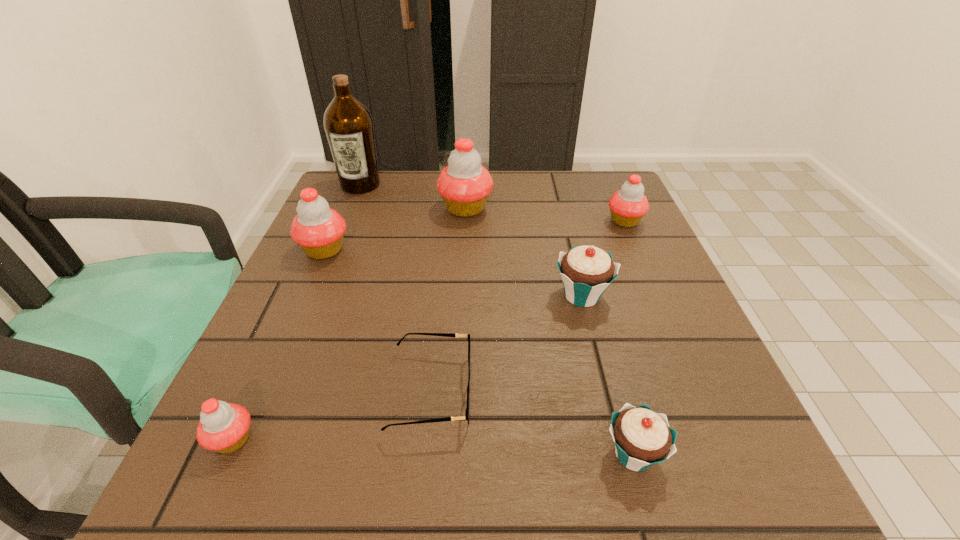
This screenshot has width=960, height=540. I want to click on vacant area at the right edge of the desktop, so click(x=632, y=275).

The image size is (960, 540). Find the location of `vacant space at the far left corner`. vacant space at the far left corner is located at coordinates (x=362, y=198).

The image size is (960, 540). In order to click on vacant area at the near left corner of the desktop in this screenshot , I will do pos(311,452).

In the image, there is a desktop. Where is `vacant area at the near right corner`? The width and height of the screenshot is (960, 540). vacant area at the near right corner is located at coordinates (691, 504).

The height and width of the screenshot is (540, 960). What are the coordinates of `blank region between the fifth farthest object and the third tallest object` in the screenshot? It's located at (453, 273).

This screenshot has width=960, height=540. What are the coordinates of `free space that is in between the rightmost cupcake and the shortest object` in the screenshot? It's located at pyautogui.click(x=528, y=306).

At what (x,y) coordinates should I click in order to perform the action: click on vacant area between the rightmost red cupcake and the shortest object. Please return your answer as a coordinate pair (x, y). This screenshot has width=960, height=540. Looking at the image, I should click on (528, 306).

This screenshot has height=540, width=960. I want to click on free space between the seventh shortest object and the rightmost red cupcake, so click(545, 215).

This screenshot has width=960, height=540. In order to click on free space between the olive oil and the biggest red cupcake in this screenshot , I will do pos(413,197).

At what (x,y) coordinates should I click in order to perform the action: click on vacant space in between the fourth farthest cupcake and the brown olive oil. Please return your answer as a coordinate pair (x, y). Looking at the image, I should click on (471, 240).